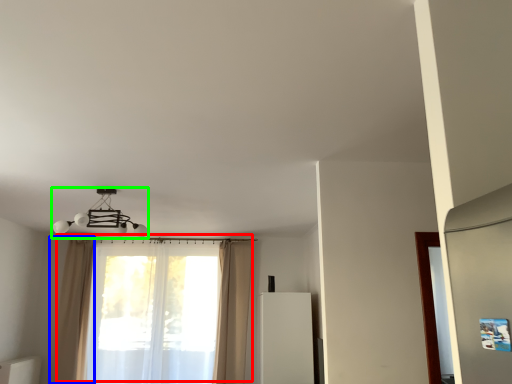
Question: Considering the real-world distances, which object is farthest from curtain (highlighted by a red box)? curtain (highlighted by a blue box) or lamp (highlighted by a green box)?

Choices:
 (A) curtain
 (B) lamp

Answer: (B)